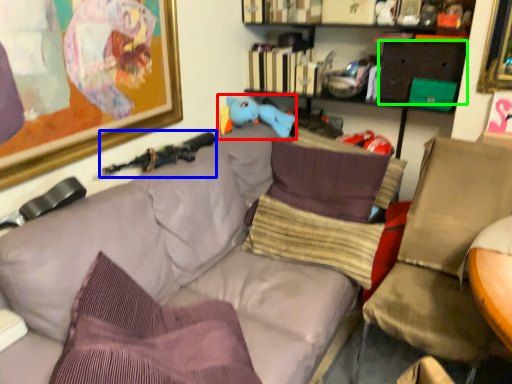
Question: Based on their relative distances, which object is nearer to toy (highlighted by a red box)? Choose from weapon (highlighted by a blue box) and drawer (highlighted by a green box).

Choices:
 (A) weapon
 (B) drawer

Answer: (A)